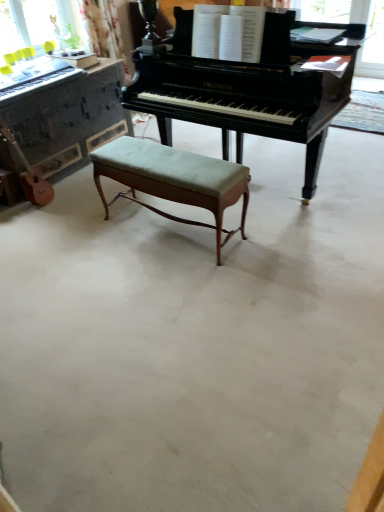
Describe the element at coordinates (173, 179) in the screenshot. I see `green fabric stool at center` at that location.

The image size is (384, 512). Describe the element at coordinates (69, 119) in the screenshot. I see `polished dark wood piano at center, the second piano when ordered from right to left` at that location.

The width and height of the screenshot is (384, 512). Describe the element at coordinates (247, 88) in the screenshot. I see `glossy black piano at center, marked as the second piano in a left-to-right arrangement` at that location.

Where is `green fabric stool at center`? The height and width of the screenshot is (512, 384). green fabric stool at center is located at coordinates (173, 179).

Is light brown wood guitar at left far from glossy black piano at center, marked as the second piano in a left-to-right arrangement?

Yes.

Is light brown wood guitar at left taller than glossy black piano at center, the first piano positioned from the right?

In fact, light brown wood guitar at left may be shorter than glossy black piano at center, the first piano positioned from the right.

Find the location of a particular element. The width and height of the screenshot is (384, 512). the 2nd piano positioned above the light brown wood guitar at left (from a real-world perspective) is located at coordinates (247, 88).

Between glossy black piano at center, marked as the second piano in a left-to-right arrangement, and matte black keyboard at left, which one has larger size?

glossy black piano at center, marked as the second piano in a left-to-right arrangement, is bigger.

From the image's perspective, is glossy black piano at center, marked as the second piano in a left-to-right arrangement, over matte black keyboard at left?

Yes.

How distant is glossy black piano at center, the first piano positioned from the right, from matte black keyboard at left?

1.35 meters.

From the picture: Which is farther, (305,104) or (33,86)?

The point (33,86) is behind.

Considering the relative sizes of matte black keyboard at left and polished dark wood piano at center, the second piano when ordered from right to left, in the image provided, is matte black keyboard at left shorter than polished dark wood piano at center, the second piano when ordered from right to left,?

Correct, matte black keyboard at left is not as tall as polished dark wood piano at center, the second piano when ordered from right to left.

In the scene shown: Which is nearer, (9, 100) or (66, 146)?

Positioned in front is point (9, 100).

How different are the orientations of matte black keyboard at left and polished dark wood piano at center, the second piano when ordered from right to left, in degrees?

0.683 degrees.

Is matte black keyboard at left facing towards polished dark wood piano at center, which is the first piano from left to right?

No, matte black keyboard at left is not aimed at polished dark wood piano at center, which is the first piano from left to right.

Are light brown wood guitar at left and matte black keyboard at left far apart?

No, there isn't a large distance between light brown wood guitar at left and matte black keyboard at left.

From a real-world perspective, relative to matte black keyboard at left, is light brown wood guitar at left vertically above or below?

light brown wood guitar at left is situated lower than matte black keyboard at left in the real world.

Who is smaller, light brown wood guitar at left or matte black keyboard at left?

matte black keyboard at left.

Which is behind, point (37, 201) or point (40, 85)?

The point (37, 201) is farther.

Does matte black keyboard at left have a lesser height compared to green fabric stool at center?

Yes.

Is point (9, 91) positioned behind point (211, 176)?

Yes.

Is matte black keyboard at left facing towards green fabric stool at center?

No, matte black keyboard at left is not aimed at green fabric stool at center.

Between matte black keyboard at left and light brown wood guitar at left, which one is positioned behind?

light brown wood guitar at left is further away from the camera.

From the image's perspective, who appears lower, matte black keyboard at left or light brown wood guitar at left?

light brown wood guitar at left, from the image's perspective.

From a real-world perspective, is matte black keyboard at left located beneath light brown wood guitar at left?

Actually, matte black keyboard at left is physically above light brown wood guitar at left in the real world.

How many degrees apart are the facing directions of matte black keyboard at left and light brown wood guitar at left?

There is a 1.16-degree angle between the facing directions of matte black keyboard at left and light brown wood guitar at left.

Is polished dark wood piano at center, which is the first piano from left to right, aimed at green fabric stool at center?

Yes, polished dark wood piano at center, which is the first piano from left to right, is turned towards green fabric stool at center.

Considering the sizes of objects polished dark wood piano at center, the second piano when ordered from right to left, and green fabric stool at center in the image provided, who is thinner, polished dark wood piano at center, the second piano when ordered from right to left, or green fabric stool at center?

green fabric stool at center is thinner.

From the image's perspective, which one is positioned higher, polished dark wood piano at center, the second piano when ordered from right to left, or green fabric stool at center?

polished dark wood piano at center, the second piano when ordered from right to left, appears higher in the image.

The image size is (384, 512). I want to click on piano that is the 2nd object above the light brown wood guitar at left (from a real-world perspective), so click(247, 88).

At what (x,y) coordinates should I click in order to perform the action: click on musical keyboard below the glossy black piano at center, marked as the second piano in a left-to-right arrangement (from the image's perspective). Please return your answer as a coordinate pair (x, y). The image size is (384, 512). Looking at the image, I should click on (38, 83).

Considering their positions, is green fabric stool at center positioned closer to glossy black piano at center, marked as the second piano in a left-to-right arrangement, than polished dark wood piano at center, the second piano when ordered from right to left?

The object closer to glossy black piano at center, marked as the second piano in a left-to-right arrangement, is green fabric stool at center.

Looking at the image, which one is located closer to green fabric stool at center, polished dark wood piano at center, the second piano when ordered from right to left, or glossy black piano at center, the first piano positioned from the right?

glossy black piano at center, the first piano positioned from the right, lies closer to green fabric stool at center than the other object.

When comparing their distances from light brown wood guitar at left, does polished dark wood piano at center, which is the first piano from left to right, or green fabric stool at center seem further?

green fabric stool at center lies further to light brown wood guitar at left than the other object.

From the image, which object appears to be nearer to light brown wood guitar at left, green fabric stool at center or glossy black piano at center, the first piano positioned from the right?

green fabric stool at center is closer to light brown wood guitar at left.

Looking at the image, which one is located further to light brown wood guitar at left, glossy black piano at center, the first piano positioned from the right, or green fabric stool at center?

glossy black piano at center, the first piano positioned from the right, lies further to light brown wood guitar at left than the other object.

Estimate the real-world distances between objects in this image. Which object is further from glossy black piano at center, marked as the second piano in a left-to-right arrangement, green fabric stool at center or light brown wood guitar at left?

light brown wood guitar at left.

From the image, which object appears to be nearer to glossy black piano at center, marked as the second piano in a left-to-right arrangement, matte black keyboard at left or green fabric stool at center?

Among the two, green fabric stool at center is located nearer to glossy black piano at center, marked as the second piano in a left-to-right arrangement.

When comparing their distances from light brown wood guitar at left, does matte black keyboard at left or polished dark wood piano at center, which is the first piano from left to right, seem closer?

Based on the image, polished dark wood piano at center, which is the first piano from left to right, appears to be nearer to light brown wood guitar at left.

You are a GUI agent. You are given a task and a screenshot of the screen. Output one action in this format:
    pyautogui.click(x=<x>, y=<y>)
    Task: Click on the stool between polished dark wood piano at center, the second piano when ordered from right to left, and glossy black piano at center, marked as the second piano in a left-to-right arrangement
    The height and width of the screenshot is (512, 384).
    Given the screenshot: What is the action you would take?
    pyautogui.click(x=173, y=179)

Identify the location of piano between matte black keyboard at left and light brown wood guitar at left vertically. tap(69, 119).

In order to click on musical keyboard located between light brown wood guitar at left and green fabric stool at center in the left-right direction in this screenshot , I will do `click(38, 83)`.

Find the location of a particular element. stool between matte black keyboard at left and glossy black piano at center, marked as the second piano in a left-to-right arrangement, from left to right is located at coordinates (173, 179).